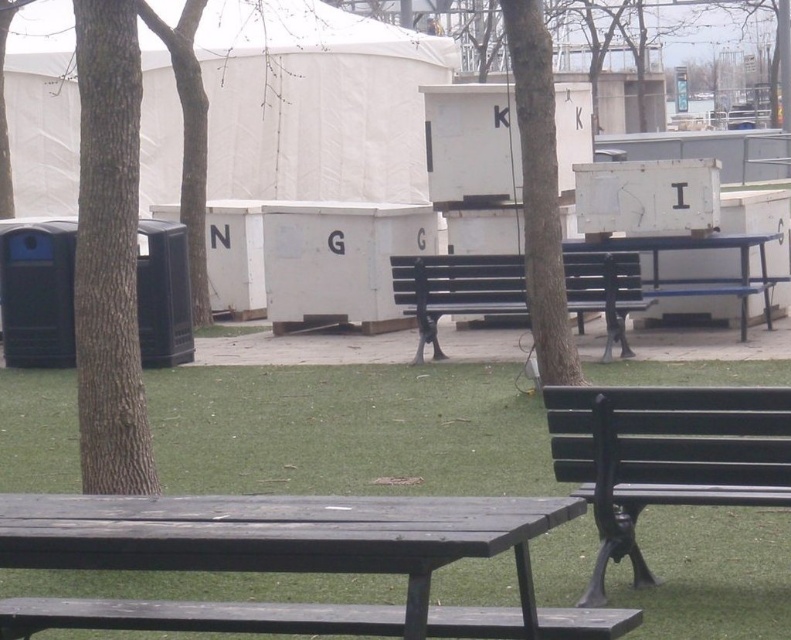
You are standing at the origin point of the coordinate system. Where is the matte black bench at center located?

The matte black bench at center is located at point (x=456, y=289).

Looking at this image, you are standing at the point labeled point at [508,269] and want to walk to the picnic tables. Are you closer to the picnic tables than the storage containers?

The picnic tables are 14.88 meters away from the point labeled point at [508,269]. Since the storage containers are in the midground and the picnic tables are in the foreground, the picnic tables are closer to the point labeled point at [508,269] than the storage containers.

You are planning to set up a small event and need to place a 3ft wide table between the matte black bench at center and the blue painted metal park bench at center. Can you fit the table there?

The matte black bench at center occupies less space than blue painted metal park bench at center, so the space between them may vary. However, since the exact distance isn not provided, it is uncertain if the 3ft wide table will fit.